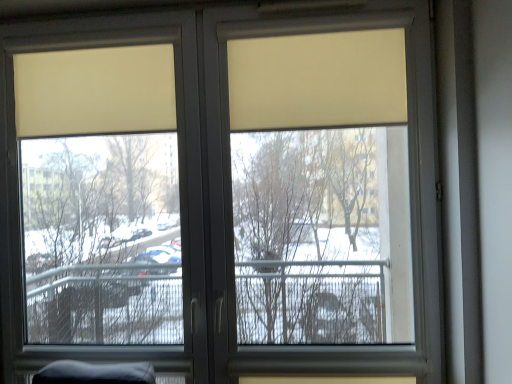
Image resolution: width=512 pixels, height=384 pixels. What do you see at coordinates (317, 80) in the screenshot? I see `beige matte curtain at upper center, the 1th curtain viewed from the right` at bounding box center [317, 80].

What is the approximate width of beige matte curtain at upper center, the 1th curtain viewed from the right?

It is 7.66 centimeters.

This screenshot has height=384, width=512. What do you see at coordinates (100, 195) in the screenshot? I see `matte plastic window screen at center` at bounding box center [100, 195].

Identify the location of beige matte curtain at upper left, the second curtain viewed from the right. (95, 91).

You are a GUI agent. You are given a task and a screenshot of the screen. Output one action in this format:
    pyautogui.click(x=<x>, y=<y>)
    Task: Click on the beige matte curtain at upper center, which is the 2th curtain in left-to-right order
    
    Given the screenshot: What is the action you would take?
    pyautogui.click(x=317, y=80)

Can you confirm if matte plastic window screen at center is positioned to the left of beige matte curtain at upper left, the first curtain positioned from the left?

Yes.

Which is in front, matte plastic window screen at center or beige matte curtain at upper left, the first curtain positioned from the left?

matte plastic window screen at center is closer to the camera.

In the scene shown: Could you tell me if matte plastic window screen at center is facing beige matte curtain at upper left, the second curtain viewed from the right?

Yes.

From the picture: Considering the sizes of matte plastic window screen at center and beige matte curtain at upper left, the first curtain positioned from the left, in the image, is matte plastic window screen at center taller or shorter than beige matte curtain at upper left, the first curtain positioned from the left,?

In the image, matte plastic window screen at center appears to be taller than beige matte curtain at upper left, the first curtain positioned from the left.

From the image's perspective, is beige matte curtain at upper left, the first curtain positioned from the left, under matte plastic window screen at center?

Actually, beige matte curtain at upper left, the first curtain positioned from the left, appears above matte plastic window screen at center in the image.

Does beige matte curtain at upper left, the second curtain viewed from the right, have a lesser height compared to matte plastic window screen at center?

Yes.

Between beige matte curtain at upper left, the first curtain positioned from the left, and matte plastic window screen at center, which one is positioned in front?

Positioned in front is matte plastic window screen at center.

Can you tell me how much beige matte curtain at upper left, the first curtain positioned from the left, and matte plastic window screen at center differ in facing direction?

0.00346 degrees separate the facing orientations of beige matte curtain at upper left, the first curtain positioned from the left, and matte plastic window screen at center.

Are beige matte curtain at upper center, which is the 2th curtain in left-to-right order, and matte plastic window screen at center beside each other?

No, beige matte curtain at upper center, which is the 2th curtain in left-to-right order, is not making contact with matte plastic window screen at center.

From a real-world perspective, is beige matte curtain at upper center, which is the 2th curtain in left-to-right order, over matte plastic window screen at center?

Yes, from a real-world perspective, beige matte curtain at upper center, which is the 2th curtain in left-to-right order, is above matte plastic window screen at center.

Considering the positions of objects beige matte curtain at upper center, which is the 2th curtain in left-to-right order, and matte plastic window screen at center in the image provided, who is more to the right, beige matte curtain at upper center, which is the 2th curtain in left-to-right order, or matte plastic window screen at center?

Positioned to the right is beige matte curtain at upper center, which is the 2th curtain in left-to-right order.

Does beige matte curtain at upper center, the 1th curtain viewed from the right, have a greater width compared to matte plastic window screen at center?

In fact, beige matte curtain at upper center, the 1th curtain viewed from the right, might be narrower than matte plastic window screen at center.

Is beige matte curtain at upper left, the first curtain positioned from the left, bigger than beige matte curtain at upper center, the 1th curtain viewed from the right?

No.

From a real-world perspective, is beige matte curtain at upper left, the second curtain viewed from the right, physically located above or below beige matte curtain at upper center, the 1th curtain viewed from the right?

Clearly, from a real-world perspective, beige matte curtain at upper left, the second curtain viewed from the right, is above beige matte curtain at upper center, the 1th curtain viewed from the right.

Consider the image. Is beige matte curtain at upper left, the first curtain positioned from the left, inside the boundaries of beige matte curtain at upper center, the 1th curtain viewed from the right, or outside?

beige matte curtain at upper left, the first curtain positioned from the left, cannot be found inside beige matte curtain at upper center, the 1th curtain viewed from the right.

Measure the distance between beige matte curtain at upper center, the 1th curtain viewed from the right, and beige matte curtain at upper left, the second curtain viewed from the right.

beige matte curtain at upper center, the 1th curtain viewed from the right, and beige matte curtain at upper left, the second curtain viewed from the right, are 55.40 centimeters apart.

Is point (298, 99) farther from camera compared to point (38, 135)?

No, it is in front of (38, 135).

Is beige matte curtain at upper center, the 1th curtain viewed from the right, in contact with beige matte curtain at upper left, the second curtain viewed from the right?

No.

Based on the photo, between beige matte curtain at upper center, which is the 2th curtain in left-to-right order, and beige matte curtain at upper left, the first curtain positioned from the left, which one appears on the right side from the viewer's perspective?

From the viewer's perspective, beige matte curtain at upper center, which is the 2th curtain in left-to-right order, appears more on the right side.

Is matte plastic window screen at center thinner than beige matte curtain at upper center, which is the 2th curtain in left-to-right order?

No, matte plastic window screen at center is not thinner than beige matte curtain at upper center, which is the 2th curtain in left-to-right order.

How far apart are matte plastic window screen at center and beige matte curtain at upper center, the 1th curtain viewed from the right?

They are 3.60 feet apart.

From the image's perspective, which one is positioned lower, matte plastic window screen at center or beige matte curtain at upper center, the 1th curtain viewed from the right?

matte plastic window screen at center.

Find the location of `window screen located below the beige matte curtain at upper center, the 1th curtain viewed from the right (from the image's perspective)`. window screen located below the beige matte curtain at upper center, the 1th curtain viewed from the right (from the image's perspective) is located at coordinates (100, 195).

At what (x,y) coordinates should I click in order to perform the action: click on curtain behind the matte plastic window screen at center. Please return your answer as a coordinate pair (x, y). Looking at the image, I should click on (95, 91).

This screenshot has height=384, width=512. Identify the location of window screen on the left of beige matte curtain at upper left, the second curtain viewed from the right. (100, 195).

Considering their positions, is beige matte curtain at upper left, the first curtain positioned from the left, positioned closer to beige matte curtain at upper center, which is the 2th curtain in left-to-right order, than matte plastic window screen at center?

beige matte curtain at upper left, the first curtain positioned from the left, lies closer to beige matte curtain at upper center, which is the 2th curtain in left-to-right order, than the other object.

When comparing their distances from matte plastic window screen at center, does beige matte curtain at upper center, the 1th curtain viewed from the right, or beige matte curtain at upper left, the first curtain positioned from the left, seem further?

beige matte curtain at upper center, the 1th curtain viewed from the right, is further to matte plastic window screen at center.

Based on their spatial positions, is beige matte curtain at upper center, which is the 2th curtain in left-to-right order, or matte plastic window screen at center further from beige matte curtain at upper left, the second curtain viewed from the right?

matte plastic window screen at center lies further to beige matte curtain at upper left, the second curtain viewed from the right, than the other object.

From the image, which object appears to be farther from beige matte curtain at upper left, the first curtain positioned from the left, matte plastic window screen at center or beige matte curtain at upper center, the 1th curtain viewed from the right?

matte plastic window screen at center is positioned further to the anchor beige matte curtain at upper left, the first curtain positioned from the left.

When comparing their distances from beige matte curtain at upper center, which is the 2th curtain in left-to-right order, does matte plastic window screen at center or beige matte curtain at upper left, the first curtain positioned from the left, seem further?

Among the two, matte plastic window screen at center is located further to beige matte curtain at upper center, which is the 2th curtain in left-to-right order.

Which object lies nearer to the anchor point matte plastic window screen at center, beige matte curtain at upper left, the second curtain viewed from the right, or beige matte curtain at upper center, which is the 2th curtain in left-to-right order?

Based on the image, beige matte curtain at upper left, the second curtain viewed from the right, appears to be nearer to matte plastic window screen at center.

You are a GUI agent. You are given a task and a screenshot of the screen. Output one action in this format:
    pyautogui.click(x=<x>, y=<y>)
    Task: Click on the curtain between matte plastic window screen at center and beige matte curtain at upper center, which is the 2th curtain in left-to-right order, from left to right
    
    Given the screenshot: What is the action you would take?
    pyautogui.click(x=95, y=91)